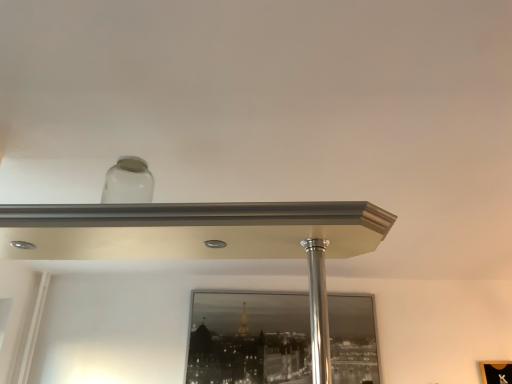
Question: Is black glass mirror at center inside or outside of polished silver pole at center?

Choices:
 (A) inside
 (B) outside

Answer: (B)

Question: Visually, is black glass mirror at center positioned to the left or to the right of polished silver pole at center?

Choices:
 (A) right
 (B) left

Answer: (B)

Question: From a real-world perspective, relative to polished silver pole at center, is black glass mirror at center vertically above or below?

Choices:
 (A) above
 (B) below

Answer: (A)

Question: Considering the positions of polished silver pole at center and black glass mirror at center in the image, is polished silver pole at center taller or shorter than black glass mirror at center?

Choices:
 (A) tall
 (B) short

Answer: (B)

Question: Considering their positions, is polished silver pole at center located in front of or behind black glass mirror at center?

Choices:
 (A) behind
 (B) front

Answer: (B)

Question: From the image's perspective, is polished silver pole at center positioned above or below black glass mirror at center?

Choices:
 (A) below
 (B) above

Answer: (B)

Question: Considering the positions of point click(317, 306) and point click(197, 332), is point click(317, 306) closer or farther from the camera than point click(197, 332)?

Choices:
 (A) closer
 (B) farther

Answer: (A)